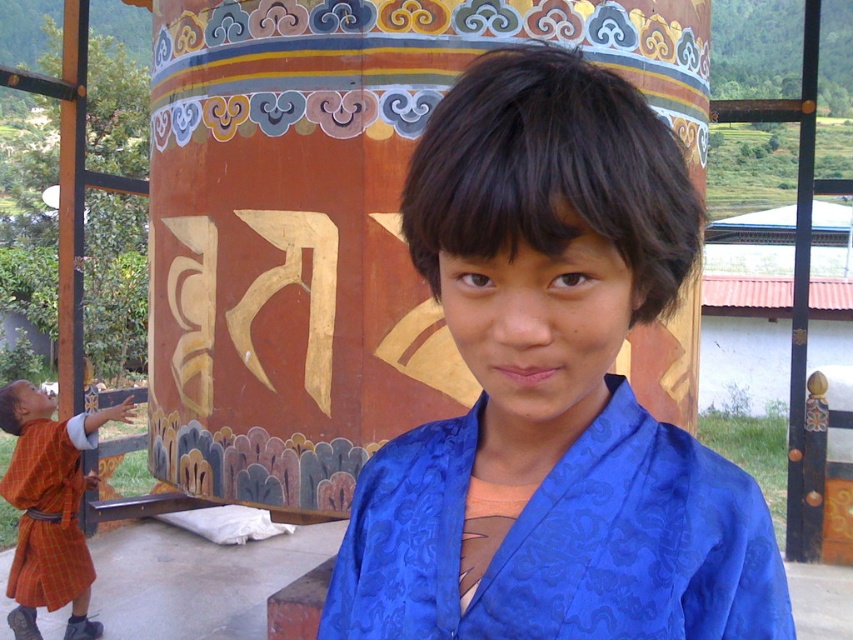
Does point (440, 492) come in front of point (38, 524)?

That is True.

Does blue satin robe at center have a larger size compared to orange plaid robe at lower left?

Actually, blue satin robe at center might be smaller than orange plaid robe at lower left.

Locate an element on the screen. This screenshot has width=853, height=640. blue satin robe at center is located at coordinates (561, 541).

This screenshot has width=853, height=640. What are the coordinates of `blue satin robe at center` in the screenshot? It's located at (561, 541).

Can you confirm if blue silk kimono at center is wider than blue satin robe at center?

Incorrect, blue silk kimono at center's width does not surpass blue satin robe at center's.

Is blue silk kimono at center to the left of blue satin robe at center from the viewer's perspective?

Correct, you'll find blue silk kimono at center to the left of blue satin robe at center.

Who is more distant from viewer, (738,480) or (480,624)?

Point (738,480)

I want to click on blue silk kimono at center, so click(552, 390).

Who is more forward, (601, 595) or (62, 445)?

Point (601, 595) is in front.

Does blue silk kimono at center have a lesser width compared to orange plaid robe at lower left?

Indeed, blue silk kimono at center has a lesser width compared to orange plaid robe at lower left.

Measure the distance between blue silk kimono at center and camera.

A distance of 36.03 inches exists between blue silk kimono at center and camera.

Identify the location of blue silk kimono at center. (552, 390).